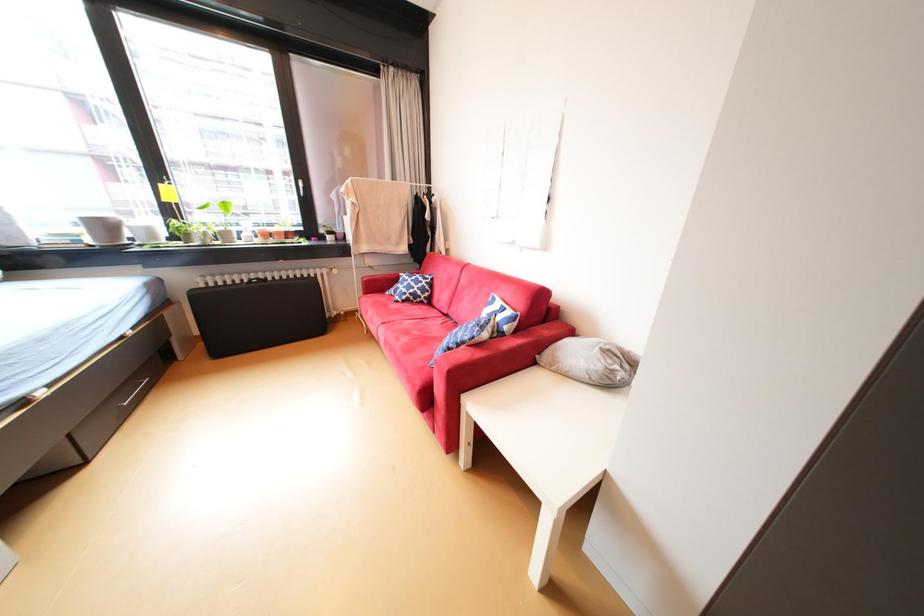
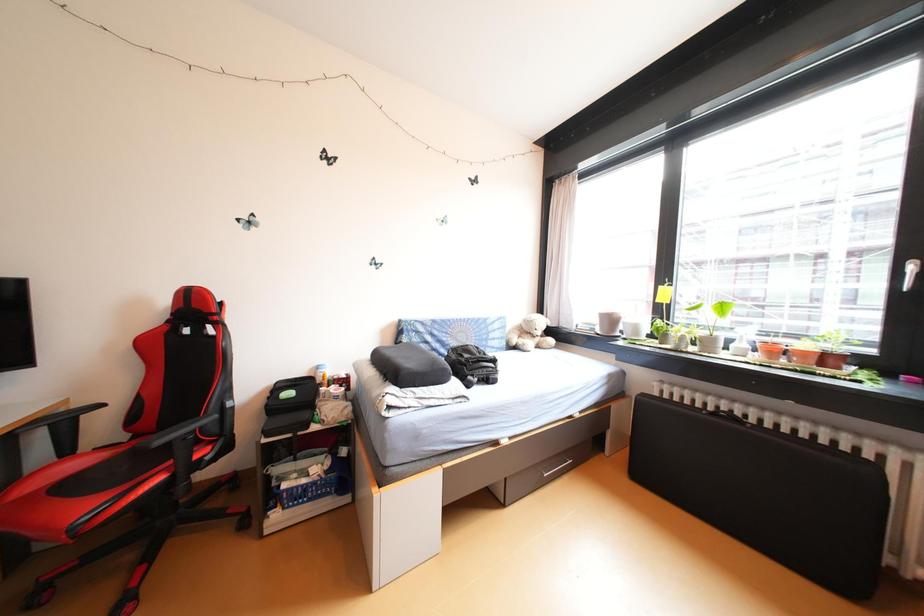
Question: The images are taken continuously from a first-person perspective. In which direction is your viewpoint rotating?

Choices:
 (A) Left
 (B) Right
 (C) Up
 (D) Down

Answer: (A)